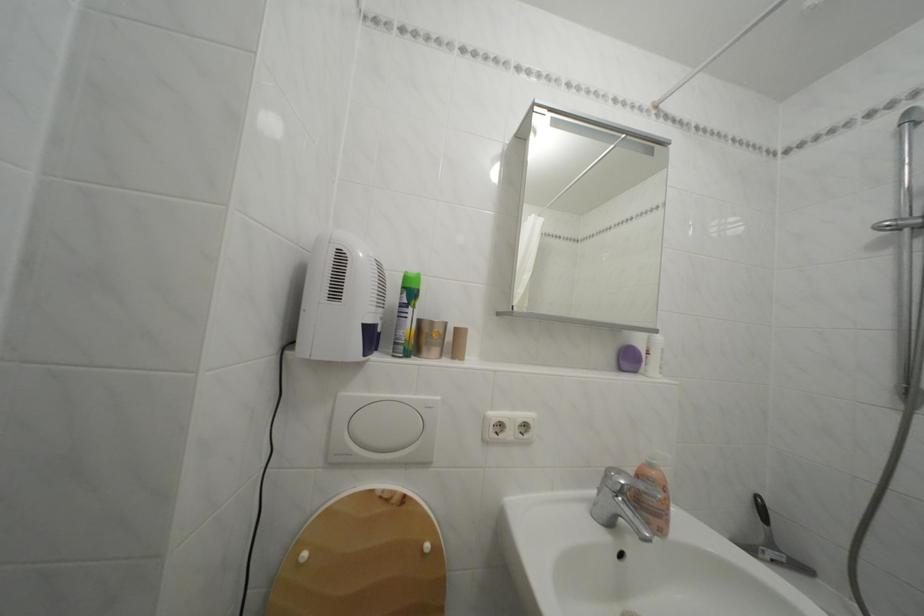
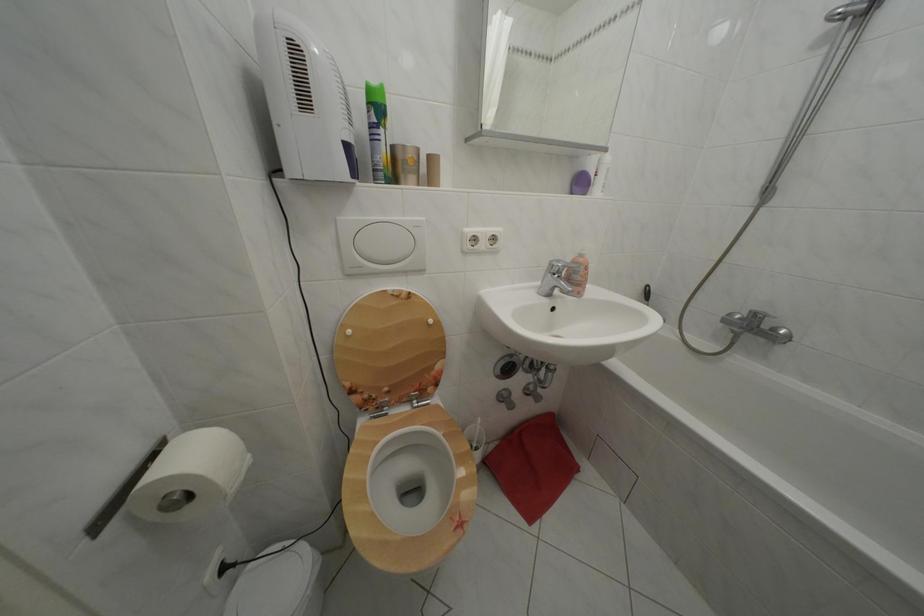
Locate, in the second image, the point that corresponds to point 411,294 in the first image.

(378, 110)